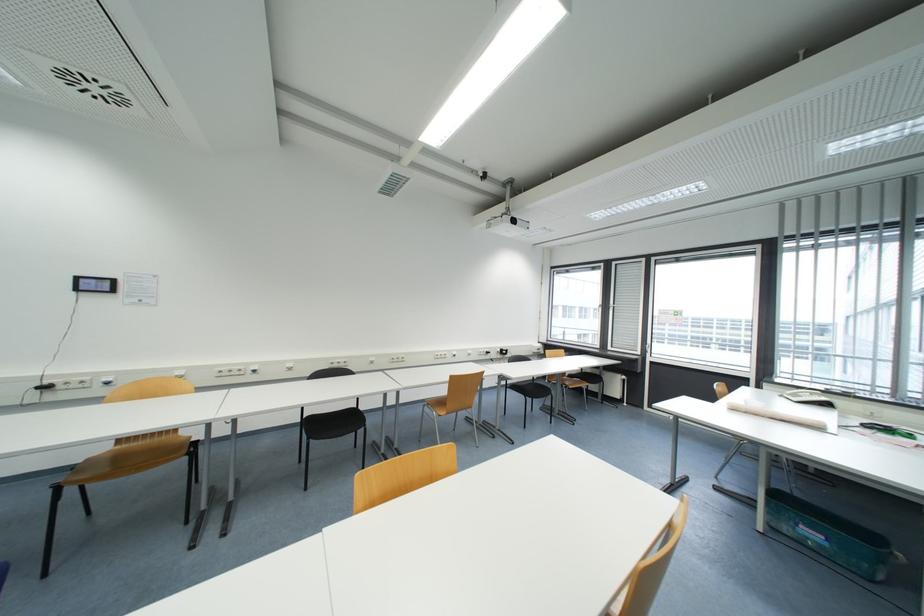
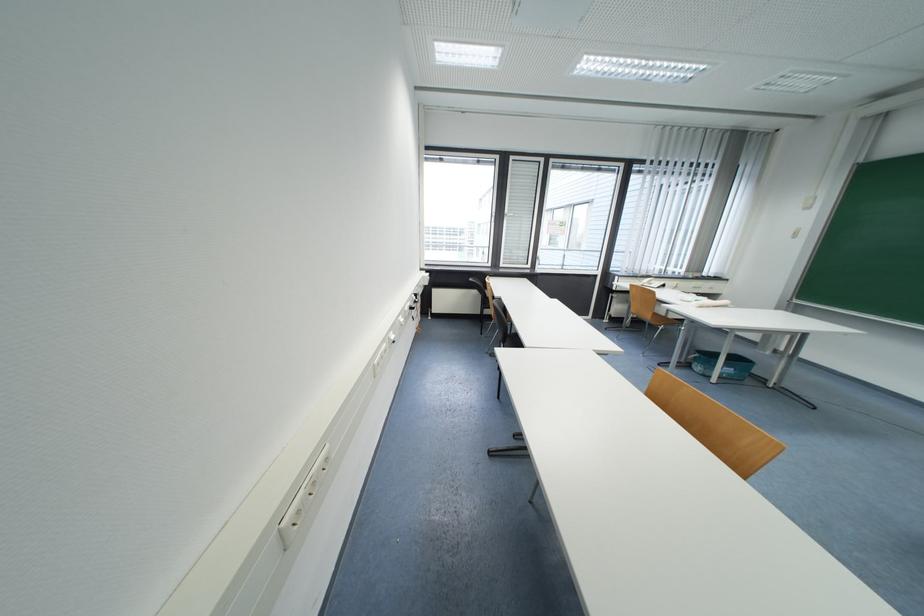
Where in the second image is the point corresponding to [824,546] from the first image?

(734, 377)